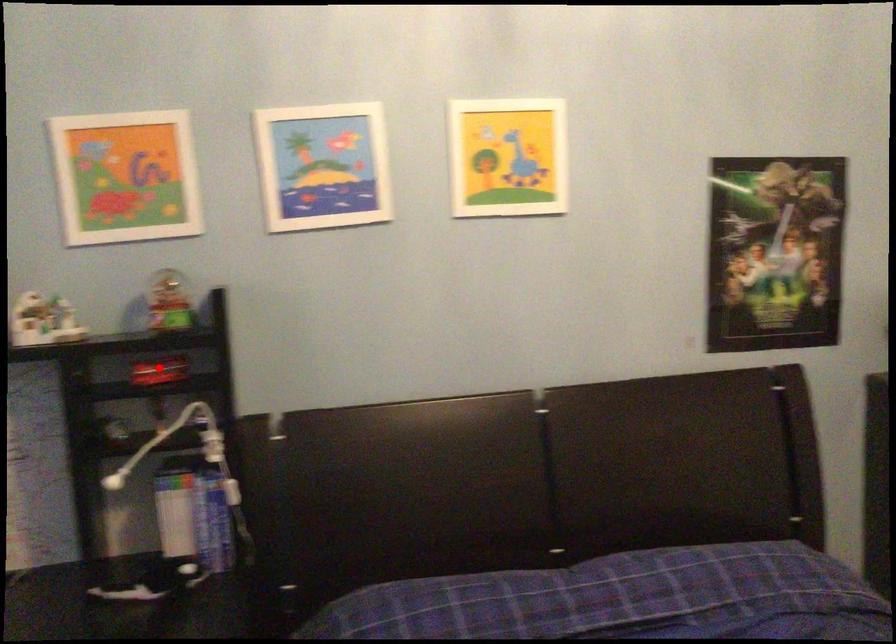
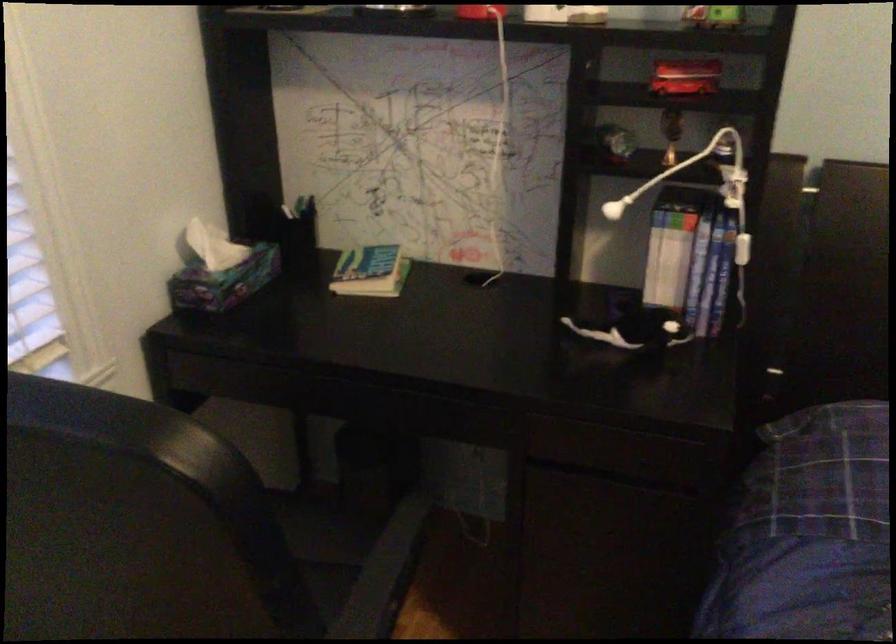
Question: I am providing you with two images of the same scene from different viewpoints. A red point is shown in image1. For the corresponding object point in image2, is it positioned nearer or farther from the camera?

Choices:
 (A) Nearer
 (B) Farther

Answer: (A)